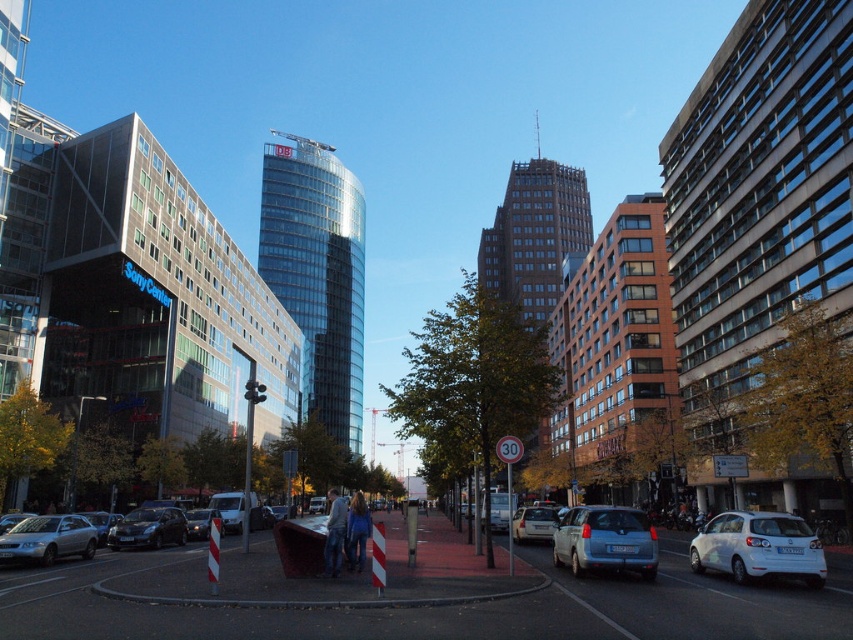
Who is positioned more to the left, blue metallic van at center or silver metallic sedan at center?

silver metallic sedan at center is more to the left.

Is blue metallic van at center wider than silver metallic sedan at center?

In fact, blue metallic van at center might be narrower than silver metallic sedan at center.

Who is more forward, (575, 513) or (521, 522)?

Positioned in front is point (575, 513).

You are a GUI agent. You are given a task and a screenshot of the screen. Output one action in this format:
    pyautogui.click(x=<x>, y=<y>)
    Task: Click on the blue metallic van at center
    This screenshot has width=853, height=640.
    Given the screenshot: What is the action you would take?
    pyautogui.click(x=605, y=540)

Who is more distant from viewer, (332,374) or (602,557)?

The point (332,374) is more distant.

Does point (270, 284) come farther from viewer compared to point (650, 573)?

Yes, it is.

Where is `transparent glass tower at center`? The height and width of the screenshot is (640, 853). transparent glass tower at center is located at coordinates (317, 273).

Between transparent glass tower at center and white matte hatchback at lower right, which one appears on the left side from the viewer's perspective?

Positioned to the left is transparent glass tower at center.

Is transparent glass tower at center taller than white matte hatchback at lower right?

Yes.

Describe the element at coordinates (317, 273) in the screenshot. The width and height of the screenshot is (853, 640). I see `transparent glass tower at center` at that location.

You are a GUI agent. You are given a task and a screenshot of the screen. Output one action in this format:
    pyautogui.click(x=<x>, y=<y>)
    Task: Click on the transparent glass tower at center
    The height and width of the screenshot is (640, 853).
    Given the screenshot: What is the action you would take?
    pyautogui.click(x=317, y=273)